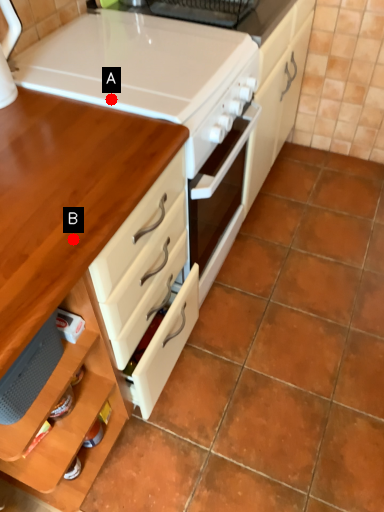
Question: Two points are circled on the image, labeled by A and B beside each circle. Which point is farther from the camera taking this photo?

Choices:
 (A) A is further
 (B) B is further

Answer: (A)